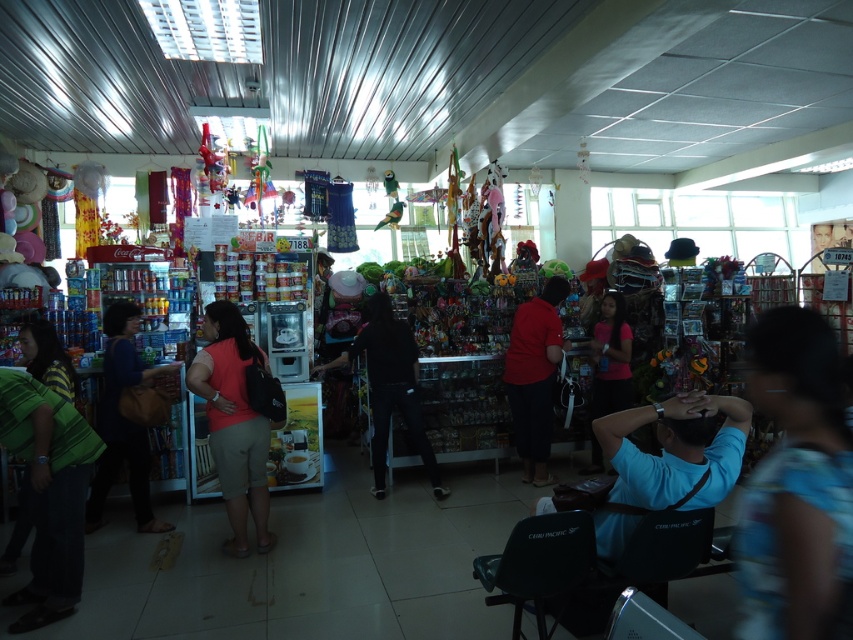
Does matte pink shirt at center appear on the left side of black matte shirt at center?

Correct, you'll find matte pink shirt at center to the left of black matte shirt at center.

Does matte pink shirt at center lie in front of black matte shirt at center?

Yes, it is.

Where is `matte pink shirt at center`? The width and height of the screenshot is (853, 640). matte pink shirt at center is located at coordinates (233, 422).

Which is more to the right, black matte shirt at center or pink matte shirt at center?

Positioned to the right is pink matte shirt at center.

Does black matte shirt at center have a larger size compared to pink matte shirt at center?

Yes, black matte shirt at center is bigger than pink matte shirt at center.

The width and height of the screenshot is (853, 640). I want to click on black matte shirt at center, so click(390, 387).

Between blue fabric shirt at right and black matte shirt at center, which one is positioned higher?

Positioned higher is blue fabric shirt at right.

Between point (744, 589) and point (419, 426), which one is positioned in front?

Point (744, 589) is more forward.

Identify the location of blue fabric shirt at right. This screenshot has width=853, height=640. (796, 484).